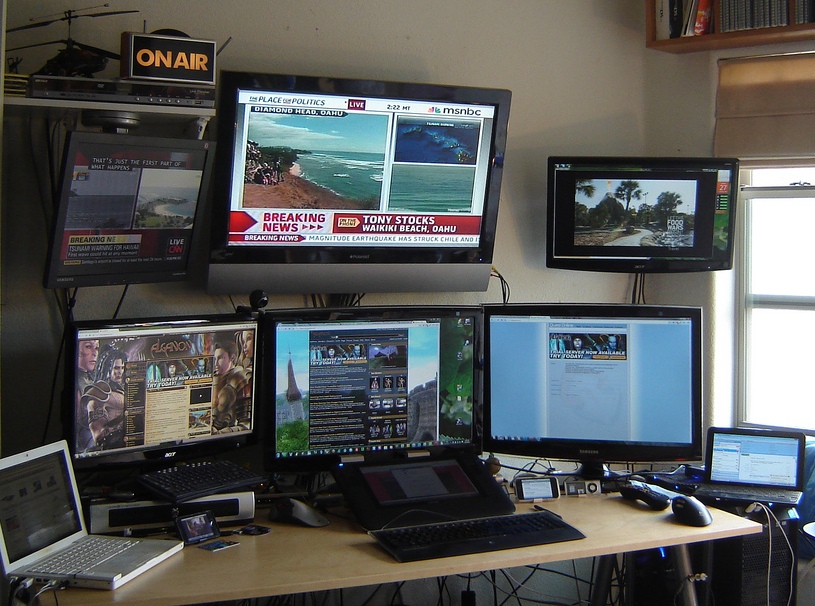
Locate an element on the screen. laptop is located at coordinates (71, 553), (738, 487).